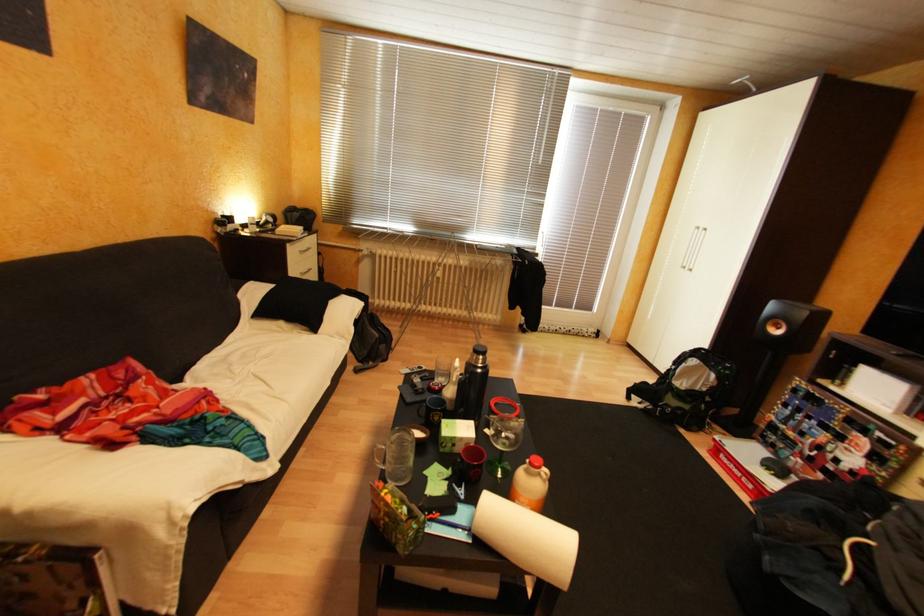
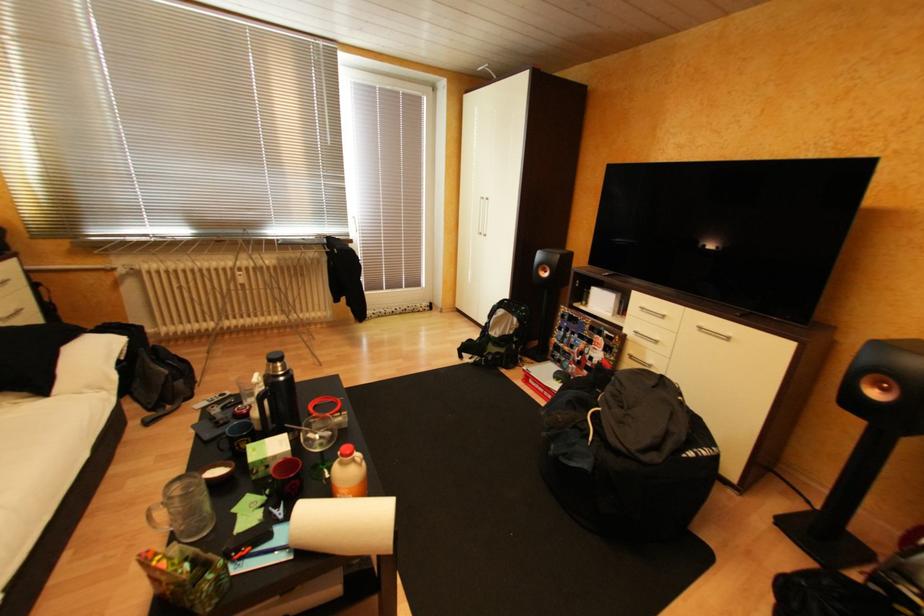
Question: The images are taken continuously from a first-person perspective. In which direction are you moving?

Choices:
 (A) Left
 (B) Right
 (C) Forward
 (D) Backward

Answer: (B)